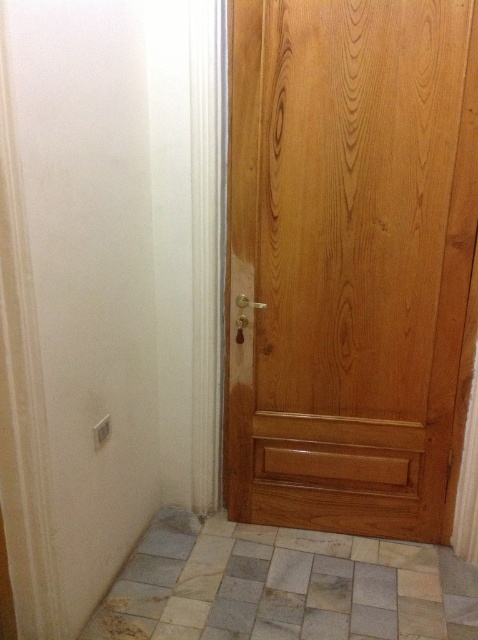
Question: Is wooden door at right thinner than natural stone tile at lower center?

Choices:
 (A) yes
 (B) no

Answer: (A)

Question: Does wooden door at right appear over natural stone tile at lower center?

Choices:
 (A) yes
 (B) no

Answer: (A)

Question: Can you confirm if wooden door at right is wider than natural stone tile at lower center?

Choices:
 (A) no
 (B) yes

Answer: (A)

Question: Which point appears farthest from the camera in this image?

Choices:
 (A) (358, 38)
 (B) (387, 579)

Answer: (B)